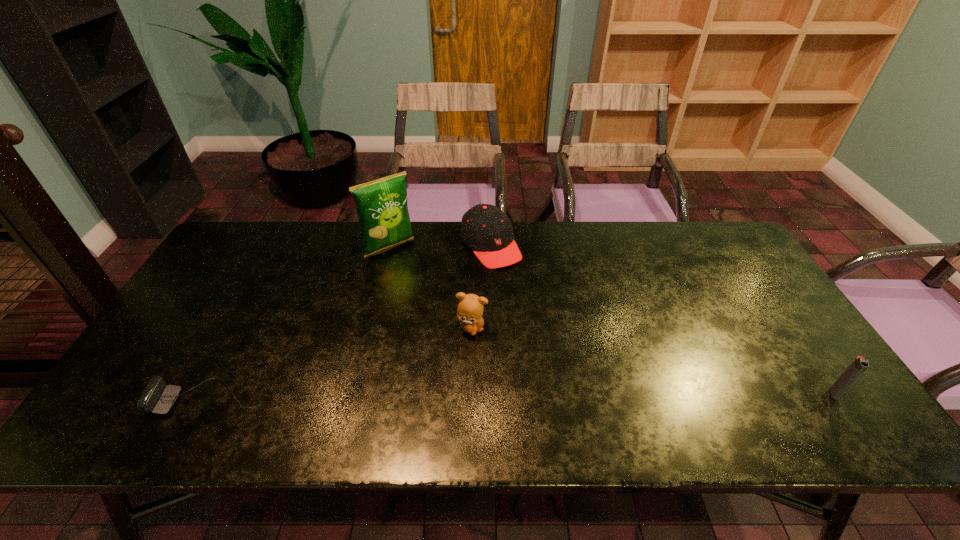
Find the location of `vacant space at the right edge of the desktop`. vacant space at the right edge of the desktop is located at coordinates (772, 316).

In the image, there is a desktop. Find the location of `free region at the near left corner`. free region at the near left corner is located at coordinates (126, 397).

At what (x,y) coordinates should I click in order to perform the action: click on vacant area at the far right corner of the desktop. Please return your answer as a coordinate pair (x, y). The width and height of the screenshot is (960, 540). Looking at the image, I should click on (705, 267).

Find the location of a particular element. This screenshot has width=960, height=540. vacant area that lies between the third farthest object and the cap is located at coordinates pyautogui.click(x=482, y=287).

Find the location of a particular element. This screenshot has width=960, height=540. vacant area that lies between the teddy bear and the shortest object is located at coordinates (342, 363).

Find the location of a particular element. vacant space in between the second object from left to right and the cap is located at coordinates pyautogui.click(x=440, y=246).

At what (x,y) coordinates should I click in order to perform the action: click on vacant space that is in between the cap and the shortest object. Please return your answer as a coordinate pair (x, y). This screenshot has height=540, width=960. Looking at the image, I should click on (351, 322).

This screenshot has height=540, width=960. What are the coordinates of `empty location between the rightmost object and the crisp (potato chip)` in the screenshot? It's located at (612, 320).

At what (x,y) coordinates should I click in order to perform the action: click on free space between the leftmost object and the teddy bear. Please return your answer as a coordinate pair (x, y). The height and width of the screenshot is (540, 960). Looking at the image, I should click on (342, 363).

I want to click on free space between the teddy bear and the webcam, so click(x=342, y=363).